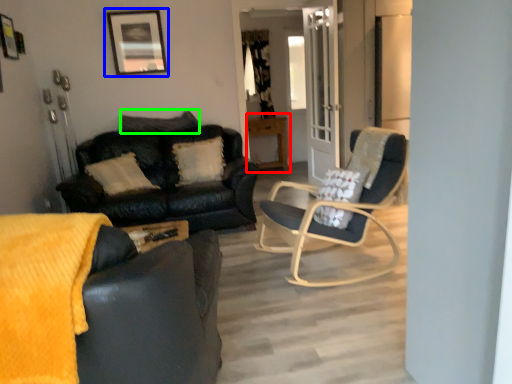
Question: Which object is the farthest from table (highlighted by a red box)? Choose among these: picture frame (highlighted by a blue box) or pillow (highlighted by a green box).

Choices:
 (A) picture frame
 (B) pillow

Answer: (A)